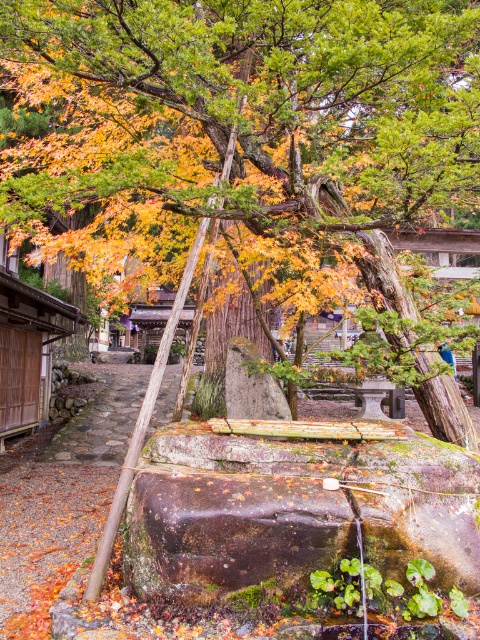
Question: Which point appears closest to the camera in this image?

Choices:
 (A) (99, 424)
 (B) (144, 202)

Answer: (A)

Question: Which of the following is the closest to the observer?

Choices:
 (A) brown stone path at center
 (B) autumn leaves at center

Answer: (B)

Question: Does autumn leaves at center have a smaller size compared to brown stone path at center?

Choices:
 (A) no
 (B) yes

Answer: (A)

Question: Is autumn leaves at center thinner than brown stone path at center?

Choices:
 (A) no
 (B) yes

Answer: (A)

Question: Can you confirm if autumn leaves at center is positioned to the left of brown stone path at center?

Choices:
 (A) yes
 (B) no

Answer: (B)

Question: Which object appears closest to the camera in this image?

Choices:
 (A) brown stone path at center
 (B) autumn leaves at center

Answer: (B)